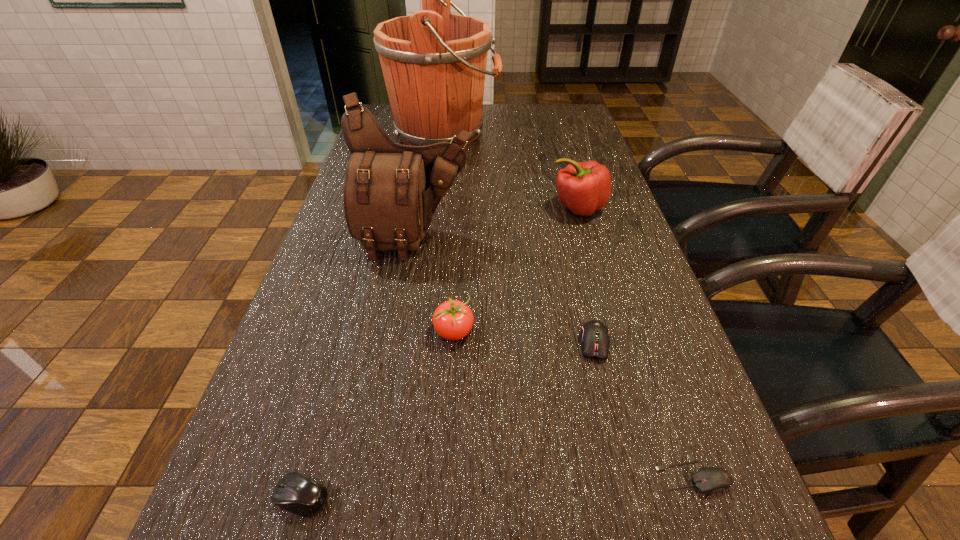
This screenshot has width=960, height=540. I want to click on bucket, so click(x=434, y=63).

The height and width of the screenshot is (540, 960). In order to click on the tallest object in this screenshot , I will do `click(434, 63)`.

You are a GUI agent. You are given a task and a screenshot of the screen. Output one action in this format:
    pyautogui.click(x=<x>, y=<y>)
    Task: Click on the shoulder bag
    
    Given the screenshot: What is the action you would take?
    pyautogui.click(x=391, y=191)

Find the location of a particular element. the third tallest object is located at coordinates (584, 187).

Find the location of a particular element. tomato is located at coordinates (453, 320).

I want to click on the farthest mouse, so click(595, 338).

I want to click on the leftmost mouse, so click(296, 493).

The height and width of the screenshot is (540, 960). What are the coordinates of `the shortest mouse` in the screenshot? It's located at (709, 480).

The height and width of the screenshot is (540, 960). In order to click on the rightmost mouse in this screenshot , I will do `click(709, 480)`.

I want to click on free location located 0.290m with the handle on the side of the tallest object, so click(x=585, y=132).